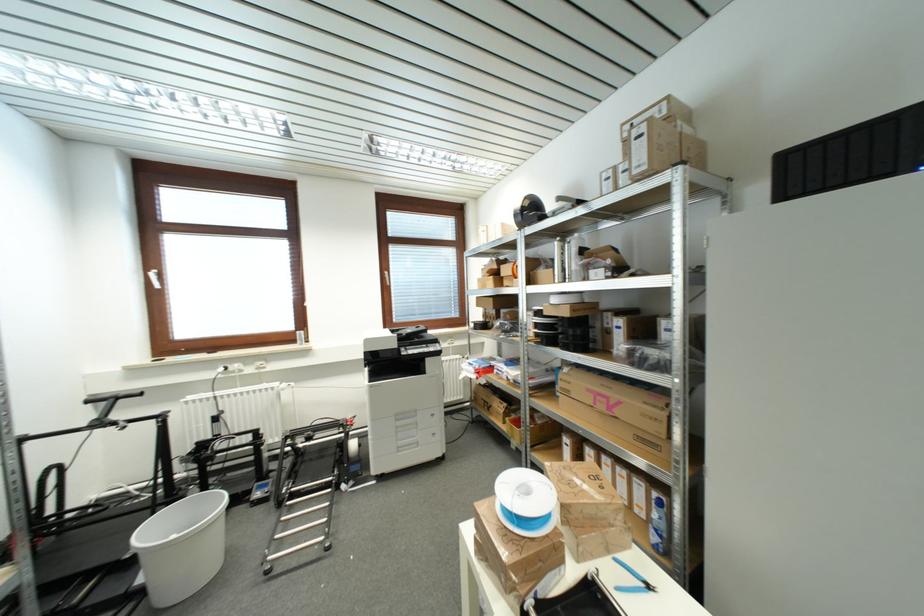
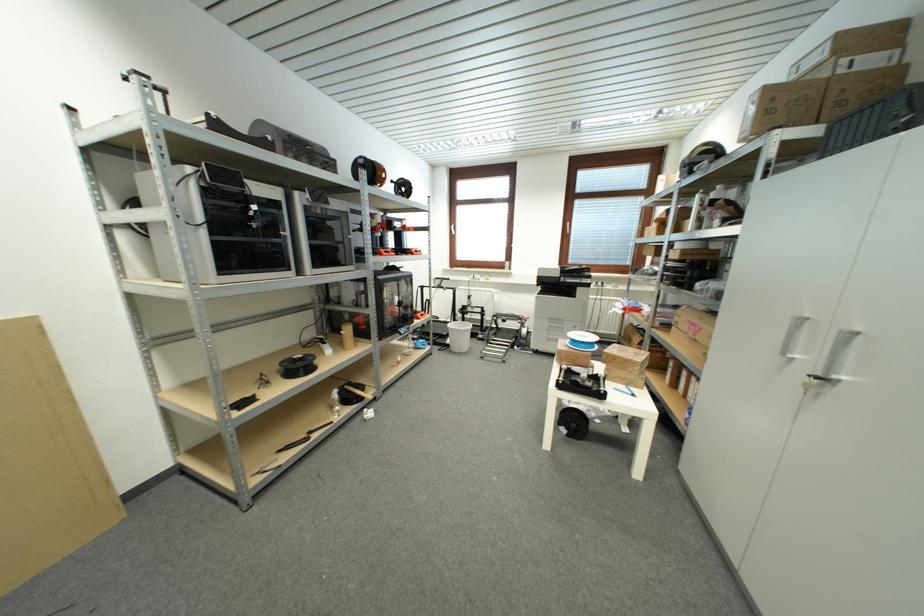
Question: I am providing you with two images of the same scene from different viewpoints. Which of the following objects are not visible in image2?

Choices:
 (A) silver cabinet handle
 (B) printer scanner lid
 (C) cardboard box
 (D) none of these

Answer: (D)